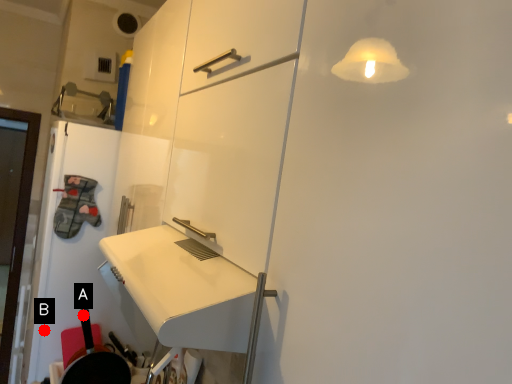
Question: Two points are circled on the image, labeled by A and B beside each circle. Which point is further to the camera?

Choices:
 (A) A is further
 (B) B is further

Answer: (B)